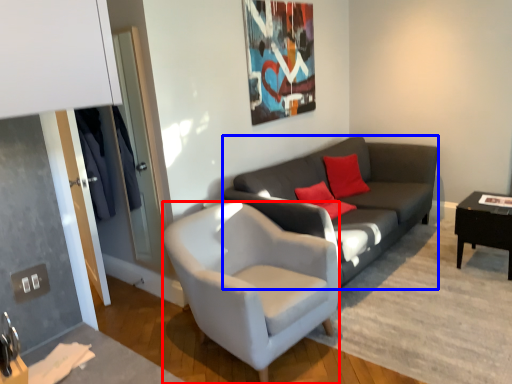
Question: Among these objects, which one is farthest to the camera, chair (highlighted by a red box) or studio couch (highlighted by a blue box)?

Choices:
 (A) chair
 (B) studio couch

Answer: (B)